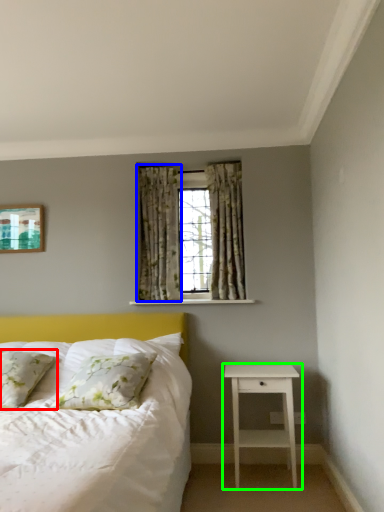
Question: Which object is the closest to the pillow (highlighted by a red box)? Choose among these: curtain (highlighted by a blue box) or nightstand (highlighted by a green box).

Choices:
 (A) curtain
 (B) nightstand

Answer: (A)